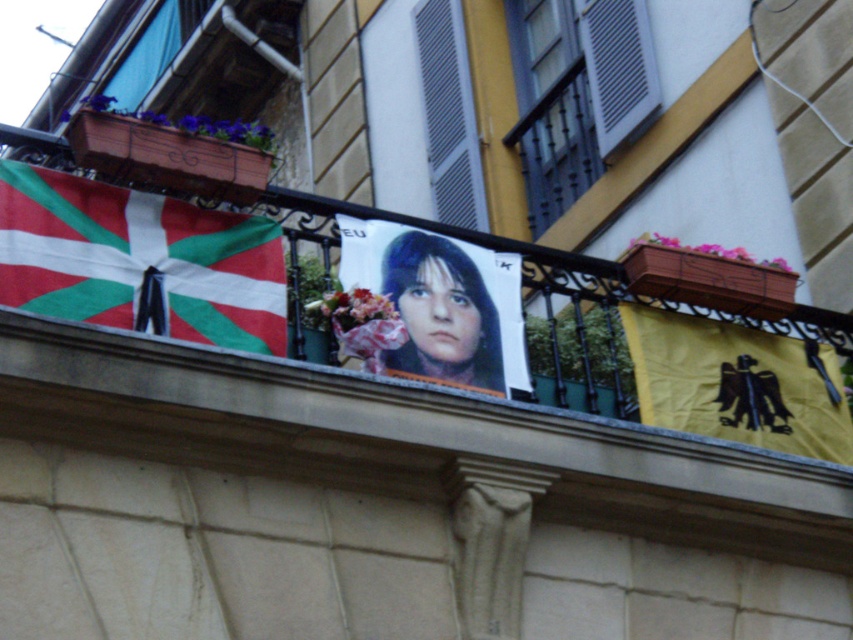
You are standing on the balcony and want to hang a new poster. The existing poster is located at point (412, 438). Where should you place your new poster to ensure it is directly above the existing one?

To place the new poster directly above the existing matte paper poster at center, you should position it at a point with the same x coordinate, 0.686, but a lower y coordinate since in coordinate systems, lower y values mean higher positions. For example, placing it at point 0.686, 0.4 would be directly above.

You are a photographer trying to capture the entire scene of the balcony. You notice the red and green fabric flag at left and the yellow fabric eagle at right. Which object should you position closer to the edge of your camera frame to ensure both fit in the shot, considering their widths?

A: The red and green fabric flag at left is thinner than the yellow fabric eagle at right. To ensure both fit in the shot, position the yellow fabric eagle at right closer to the edge of your camera frame since it is wider and requires more space.